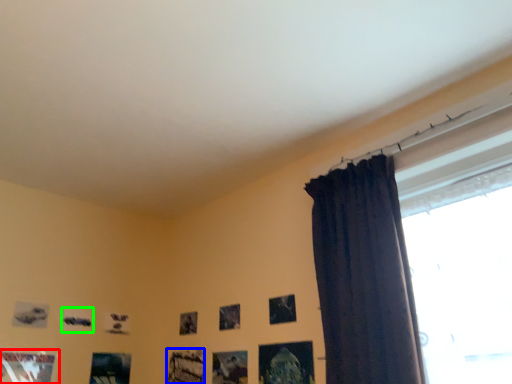
Question: Considering the real-world distances, which object is farthest from picture frame (highlighted by a red box)? picture frame (highlighted by a blue box) or picture frame (highlighted by a green box)?

Choices:
 (A) picture frame
 (B) picture frame

Answer: (A)